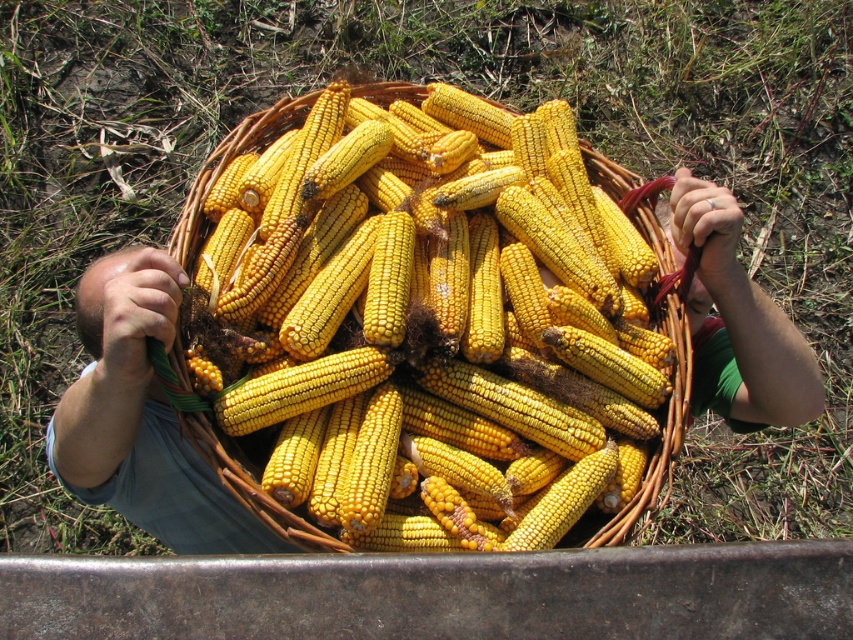
You are a farmer who just finished harvesting corn. You notice a woven brown basket at center and a green fabric hand at upper center in your view. Which object is covering the other one?

The woven brown basket at center is positioned over green fabric hand at upper center, so the basket is covering the hand.

You are a farmer trying to carry the woven brown basket at center and the green fabric hand at upper center. Which object is wider?

The woven brown basket at center is wider than the green fabric hand at upper center.

You are standing at the point closest to the person in the image. There are two points marked in the scene, one at coordinates point (604, 262) and another at point (746, 296). Which point is farther away from you?

Point (604, 262) is behind point (746, 296), so the point farther away from you is point (604, 262).